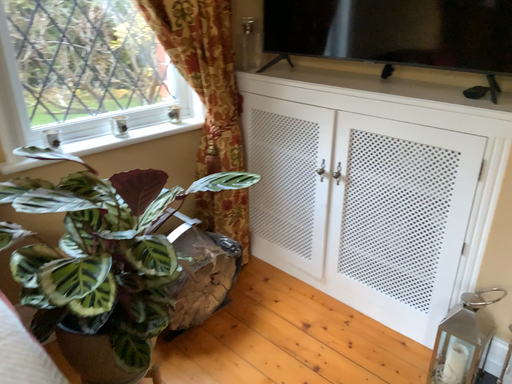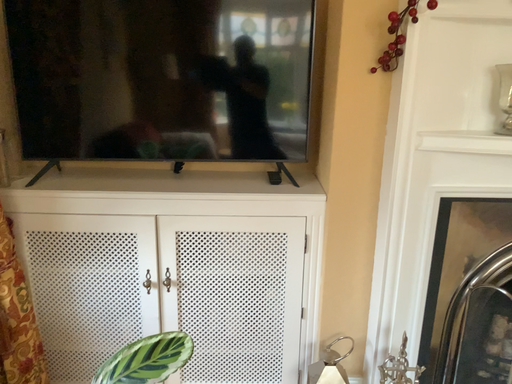
Question: How did the camera likely rotate when shooting the video?

Choices:
 (A) rotated right
 (B) rotated left

Answer: (A)